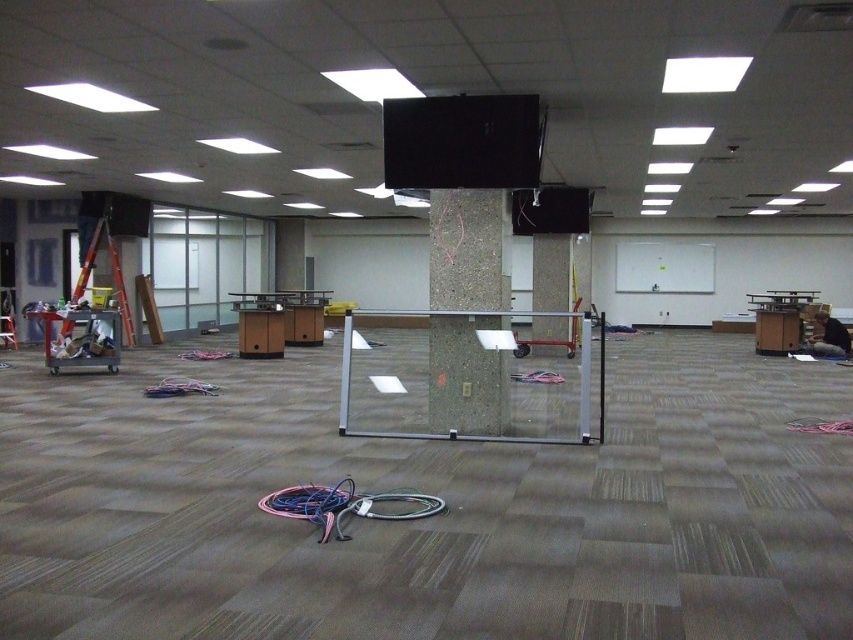
You are an interior designer assessing the space. You need to place a 2.5 meter tall sculpture in the room. Considering the height of the concrete at center and the textured concrete pillar at center, which one would be a better option to place the sculpture next to without blocking the view of the sculpture?

The concrete at center is taller than the textured concrete pillar at center, so placing the sculpture next to the shorter textured concrete pillar at center would ensure the sculpture remains visible without obstruction.

You are standing in the center of the room. Where is the concrete at center located relative to your position?

The concrete at center is located at point (469,250) relative to your position.